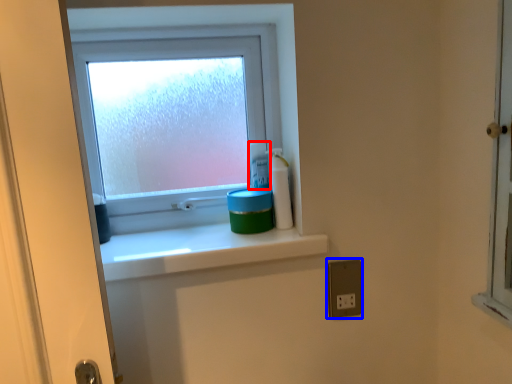
Question: Among these objects, which one is nearest to the camera, toiletry (highlighted by a red box) or electric outlet (highlighted by a blue box)?

Choices:
 (A) toiletry
 (B) electric outlet

Answer: (B)